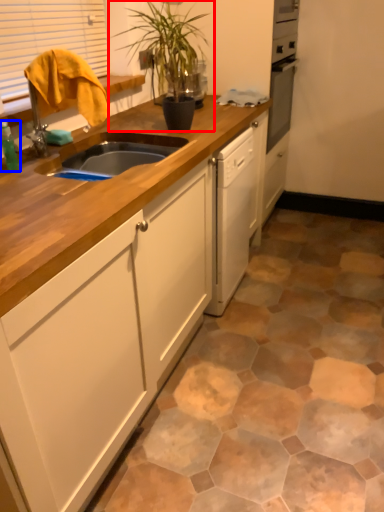
Question: Which of the following is the farthest to the observer, houseplant (highlighted by a red box) or bottle (highlighted by a blue box)?

Choices:
 (A) houseplant
 (B) bottle

Answer: (A)